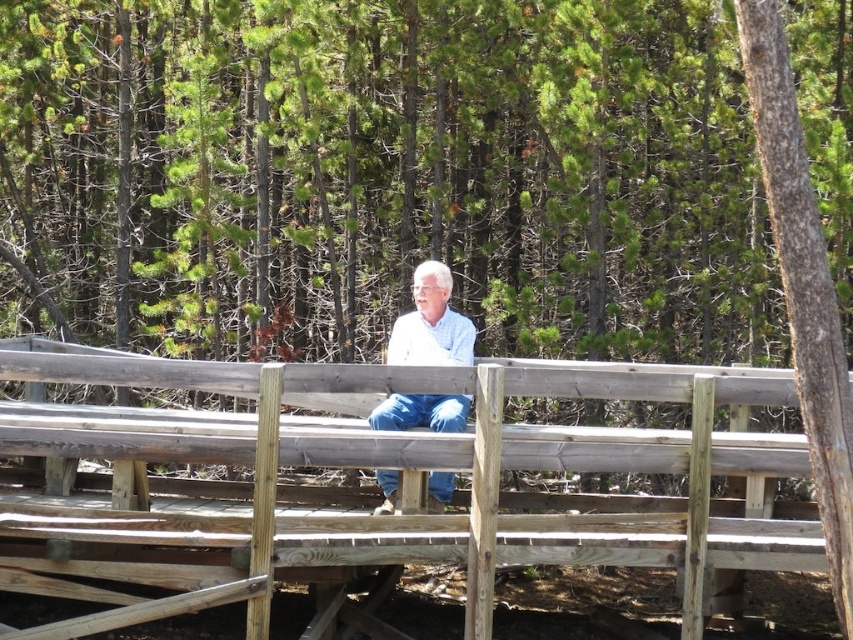
Question: Is weathered wood rail at center to the right of light blue denim jeans at center from the viewer's perspective?

Choices:
 (A) no
 (B) yes

Answer: (B)

Question: Which point is farther to the camera?

Choices:
 (A) (401, 323)
 (B) (253, 467)

Answer: (A)

Question: Does weathered wood rail at center appear on the right side of light blue denim jeans at center?

Choices:
 (A) no
 (B) yes

Answer: (B)

Question: Among these points, which one is nearest to the camera?

Choices:
 (A) (714, 548)
 (B) (442, 262)

Answer: (A)

Question: In this image, where is weathered wood rail at center located relative to light blue denim jeans at center?

Choices:
 (A) left
 (B) right

Answer: (B)